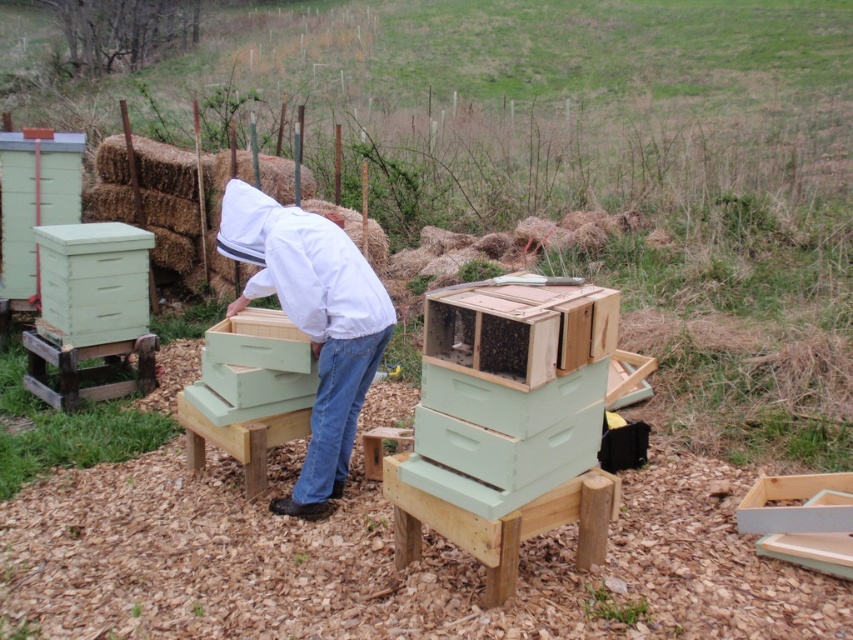
Question: Can you confirm if light green wooden beehive at center is positioned above white matte beekeeper suit at center?

Choices:
 (A) no
 (B) yes

Answer: (A)

Question: Among these points, which one is nearest to the camera?

Choices:
 (A) click(260, 282)
 (B) click(608, 300)

Answer: (B)

Question: Is light green wooden beehive at center smaller than white matte beekeeper suit at center?

Choices:
 (A) no
 (B) yes

Answer: (B)

Question: Is light green wooden beehive at center closer to camera compared to white matte beekeeper suit at center?

Choices:
 (A) no
 (B) yes

Answer: (B)